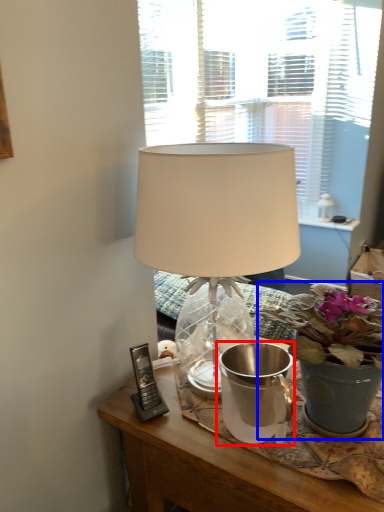
Question: Which point is closer to the camera, watering can (highlighted by a red box) or houseplant (highlighted by a blue box)?

Choices:
 (A) watering can
 (B) houseplant

Answer: (B)